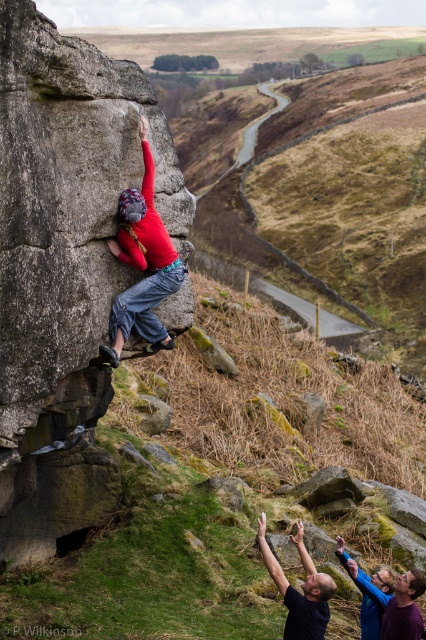
You are a photographer positioned at the base of the rock, aiming to capture the climber and the two supporters. You notice two points marked on your camera screen at coordinates point (55, 444) and point (319, 628). Which point is closer to your camera lens?

Point (55, 444) is further to the camera than point (319, 628), so the point closer to the camera lens is point (319, 628).